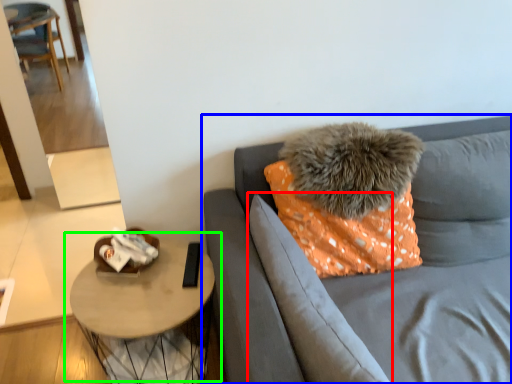
Question: Which is nearer to the pillow (highlighted by a red box)? studio couch (highlighted by a blue box) or table (highlighted by a green box).

Choices:
 (A) studio couch
 (B) table

Answer: (A)